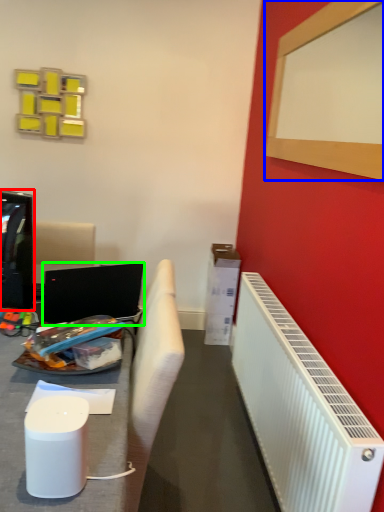
Question: Which is nearer to the television (highlighted by a red box)? bulletin board (highlighted by a blue box) or laptop (highlighted by a green box).

Choices:
 (A) bulletin board
 (B) laptop

Answer: (B)